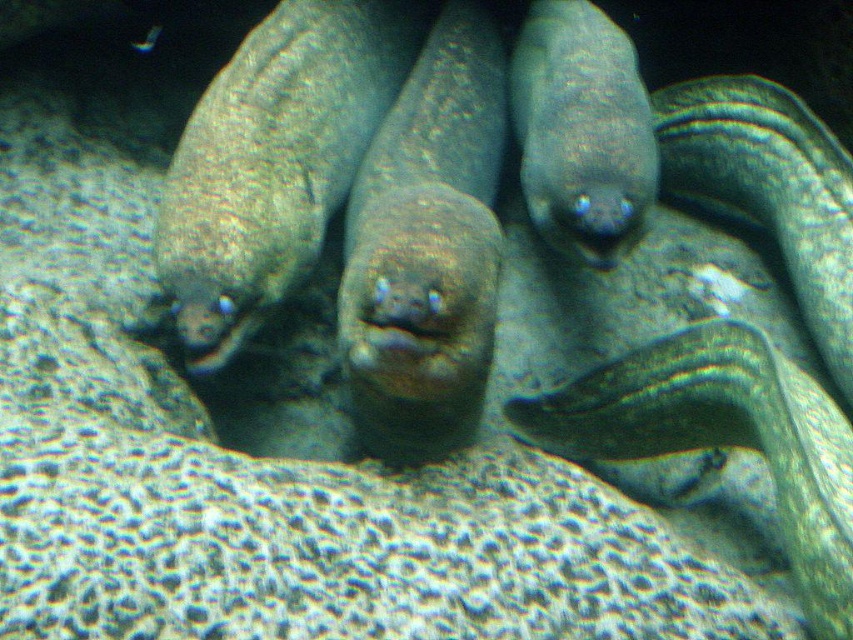
Between point (827, 436) and point (585, 132), which one is positioned in front?

Point (827, 436)

What do you see at coordinates (723, 436) in the screenshot? I see `green striped eel at center` at bounding box center [723, 436].

Between point (654, 371) and point (553, 90), which one is positioned in front?

Point (654, 371) is in front.

I want to click on green striped eel at center, so click(x=723, y=436).

Is sandy brown skin at center wider than green striped eel at center?

No.

Between sandy brown skin at center and green striped eel at center, which one is positioned lower?

green striped eel at center is below.

Does point (384, 419) come farther from viewer compared to point (840, 474)?

Yes.

Locate an element on the screen. sandy brown skin at center is located at coordinates (427, 248).

Does sandy brown skin at center have a lesser width compared to slick green eel at center?

No.

Describe the element at coordinates (427, 248) in the screenshot. I see `sandy brown skin at center` at that location.

Describe the element at coordinates (427, 248) in the screenshot. The image size is (853, 640). I see `sandy brown skin at center` at that location.

I want to click on sandy brown skin at center, so click(427, 248).